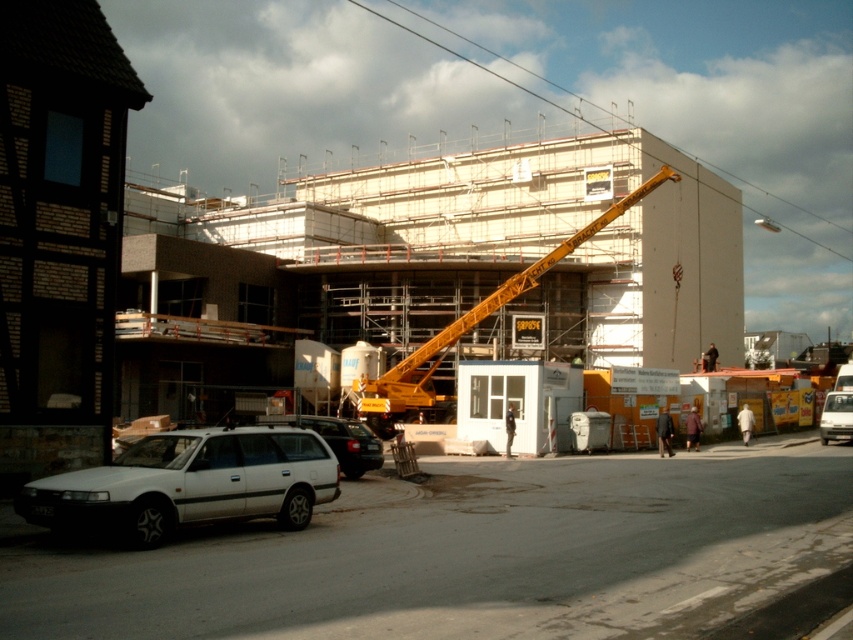
Is point (270, 458) positioned before point (335, 444)?

Yes, point (270, 458) is closer to viewer.

You are a GUI agent. You are given a task and a screenshot of the screen. Output one action in this format:
    pyautogui.click(x=<x>, y=<y>)
    Task: Click on the white matte wagon at lower left
    This screenshot has width=853, height=640.
    Given the screenshot: What is the action you would take?
    189,483

Is point (381, 465) in front of point (824, 413)?

Yes, point (381, 465) is in front of point (824, 413).

Is white matte car at lower left to the right of white matte van at lower right from the viewer's perspective?

In fact, white matte car at lower left is to the left of white matte van at lower right.

Which is in front, point (374, 440) or point (830, 406)?

Point (374, 440)

The height and width of the screenshot is (640, 853). Identify the location of white matte car at lower left. (340, 440).

Does yellow metallic crane at center have a larger size compared to dark blue uniform at center?

Correct, yellow metallic crane at center is larger in size than dark blue uniform at center.

Is yellow metallic crane at center thinner than dark blue uniform at center?

In fact, yellow metallic crane at center might be wider than dark blue uniform at center.

What do you see at coordinates (466, 332) in the screenshot?
I see `yellow metallic crane at center` at bounding box center [466, 332].

Where is `yellow metallic crane at center`? The image size is (853, 640). yellow metallic crane at center is located at coordinates (466, 332).